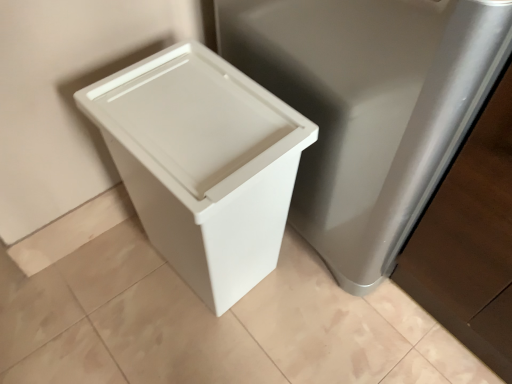
At what (x,y) coordinates should I click in order to perform the action: click on white plastic waste container at left. Please return your answer as a coordinate pair (x, y). Looking at the image, I should click on (203, 164).

Where is `white plastic waste container at left`? The image size is (512, 384). white plastic waste container at left is located at coordinates (203, 164).

Which object is wider, white plastic waste container at left or beige wood baseboard at lower left?

Wider between the two is white plastic waste container at left.

Could you tell me if white plastic waste container at left is facing beige wood baseboard at lower left?

No, white plastic waste container at left is not turned towards beige wood baseboard at lower left.

Based on the photo, considering the relative positions of white plastic waste container at left and beige wood baseboard at lower left in the image provided, is white plastic waste container at left to the left or to the right of beige wood baseboard at lower left?

Based on their positions, white plastic waste container at left is located to the right of beige wood baseboard at lower left.

Relative to beige wood baseboard at lower left, is white plastic waste container at left in front or behind?

white plastic waste container at left is in front of beige wood baseboard at lower left.

From the image's perspective, is satin silver cabinet at right positioned above or below beige wood baseboard at lower left?

From the image's perspective, satin silver cabinet at right appears above beige wood baseboard at lower left.

Identify the location of square below the satin silver cabinet at right (from a real-world perspective). The width and height of the screenshot is (512, 384). (72, 230).

Would you say beige wood baseboard at lower left is part of satin silver cabinet at right's contents?

That's incorrect, beige wood baseboard at lower left is not inside satin silver cabinet at right.

The height and width of the screenshot is (384, 512). Find the location of `cabinetry to the right of beige wood baseboard at lower left`. cabinetry to the right of beige wood baseboard at lower left is located at coordinates (470, 239).

In terms of size, does beige wood baseboard at lower left appear bigger or smaller than satin silver cabinet at right?

In the image, beige wood baseboard at lower left appears to be smaller than satin silver cabinet at right.

Considering the positions of objects beige wood baseboard at lower left and satin silver cabinet at right in the image provided, who is in front, beige wood baseboard at lower left or satin silver cabinet at right?

satin silver cabinet at right is in front.

Would you say beige wood baseboard at lower left is outside satin silver cabinet at right?

Yes, beige wood baseboard at lower left is not within satin silver cabinet at right.

At what (x,y) coordinates should I click in order to perform the action: click on cabinetry above the white plastic waste container at left (from a real-world perspective). Please return your answer as a coordinate pair (x, y). This screenshot has width=512, height=384. Looking at the image, I should click on (470, 239).

Who is bigger, white plastic waste container at left or satin silver cabinet at right?

Bigger between the two is satin silver cabinet at right.

From the image's perspective, which one is positioned higher, white plastic waste container at left or satin silver cabinet at right?

satin silver cabinet at right appears higher in the image.

From a real-world perspective, relative to satin silver cabinet at right, is white plastic waste container at left vertically above or below?

From a real-world perspective, white plastic waste container at left is physically below satin silver cabinet at right.

From the image's perspective, does beige wood baseboard at lower left appear higher than white plastic waste container at left?

No, from the image's perspective, beige wood baseboard at lower left is not over white plastic waste container at left.

Can you confirm if beige wood baseboard at lower left is shorter than white plastic waste container at left?

Yes, beige wood baseboard at lower left is shorter than white plastic waste container at left.

From a real-world perspective, is beige wood baseboard at lower left located beneath white plastic waste container at left?

Yes.

Which object is positioned more to the right, beige wood baseboard at lower left or white plastic waste container at left?

Positioned to the right is white plastic waste container at left.

From a real-world perspective, which object rests below the other?

In real-world perspective, white plastic waste container at left is lower.

Which is more to the left, satin silver cabinet at right or white plastic waste container at left?

white plastic waste container at left.

Is white plastic waste container at left at the back of satin silver cabinet at right?

No, satin silver cabinet at right's orientation is not away from white plastic waste container at left.

Identify the location of waste container lying in front of the beige wood baseboard at lower left. This screenshot has width=512, height=384. (203, 164).

Locate an element on the screen. This screenshot has height=384, width=512. cabinetry that is on the right side of beige wood baseboard at lower left is located at coordinates (470, 239).

When comparing their distances from satin silver cabinet at right, does white plastic waste container at left or beige wood baseboard at lower left seem further?

Based on the image, beige wood baseboard at lower left appears to be further to satin silver cabinet at right.

Estimate the real-world distances between objects in this image. Which object is further from white plastic waste container at left, beige wood baseboard at lower left or satin silver cabinet at right?

beige wood baseboard at lower left is further to white plastic waste container at left.

Looking at the image, which one is located further to beige wood baseboard at lower left, white plastic waste container at left or satin silver cabinet at right?

satin silver cabinet at right is positioned further to the anchor beige wood baseboard at lower left.

Looking at the image, which one is located closer to beige wood baseboard at lower left, satin silver cabinet at right or white plastic waste container at left?

white plastic waste container at left is positioned closer to the anchor beige wood baseboard at lower left.

Looking at the image, which one is located further to satin silver cabinet at right, beige wood baseboard at lower left or white plastic waste container at left?

beige wood baseboard at lower left is positioned further to the anchor satin silver cabinet at right.

Which object lies further to the anchor point white plastic waste container at left, satin silver cabinet at right or beige wood baseboard at lower left?

beige wood baseboard at lower left.

Where is `waste container situated between beige wood baseboard at lower left and satin silver cabinet at right from left to right`? waste container situated between beige wood baseboard at lower left and satin silver cabinet at right from left to right is located at coordinates tap(203, 164).